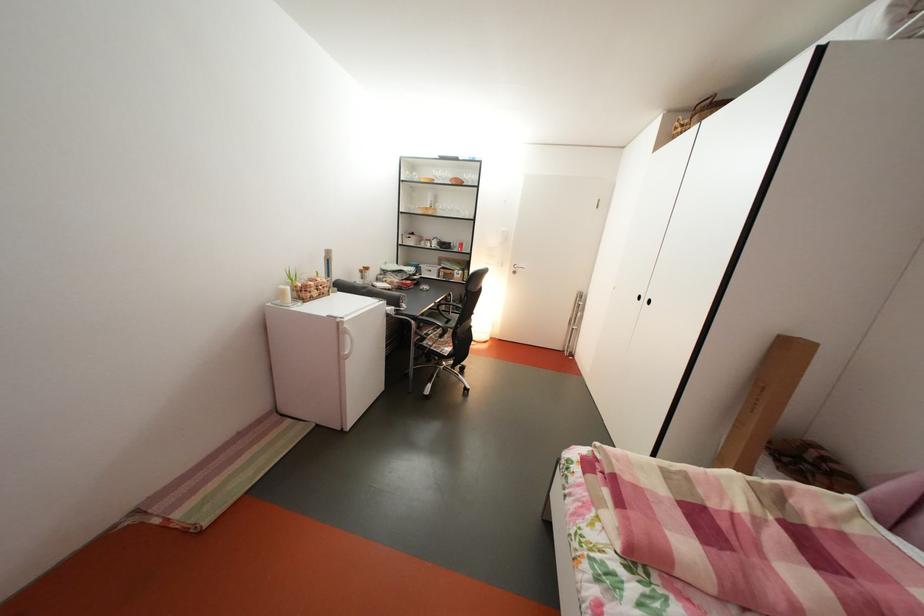
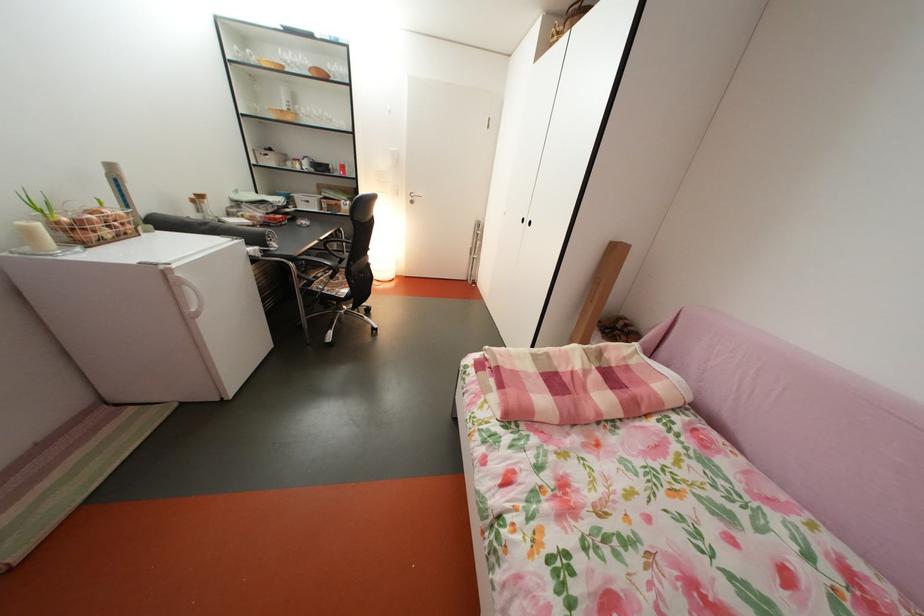
In the second image, find the point that corresponds to point (326, 300) in the first image.

(118, 238)